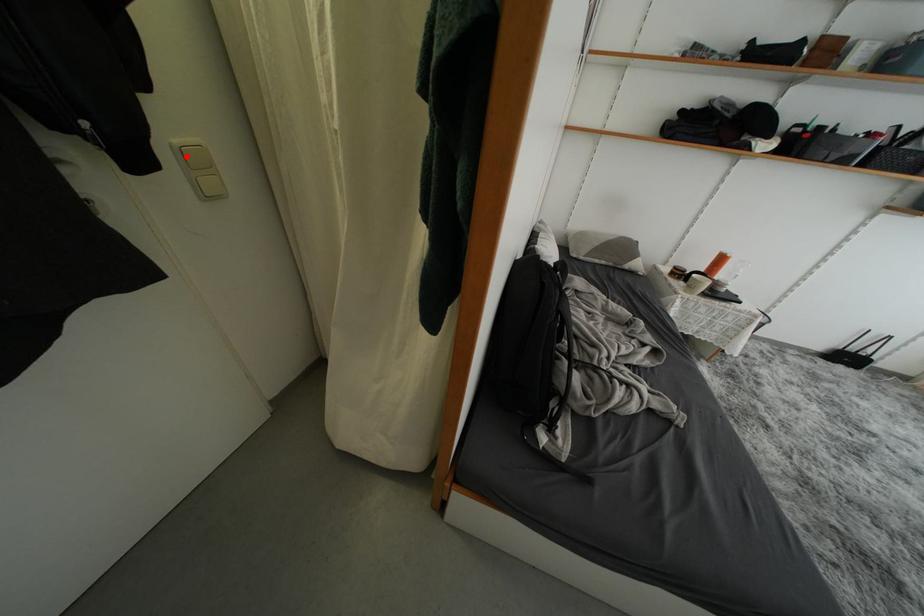
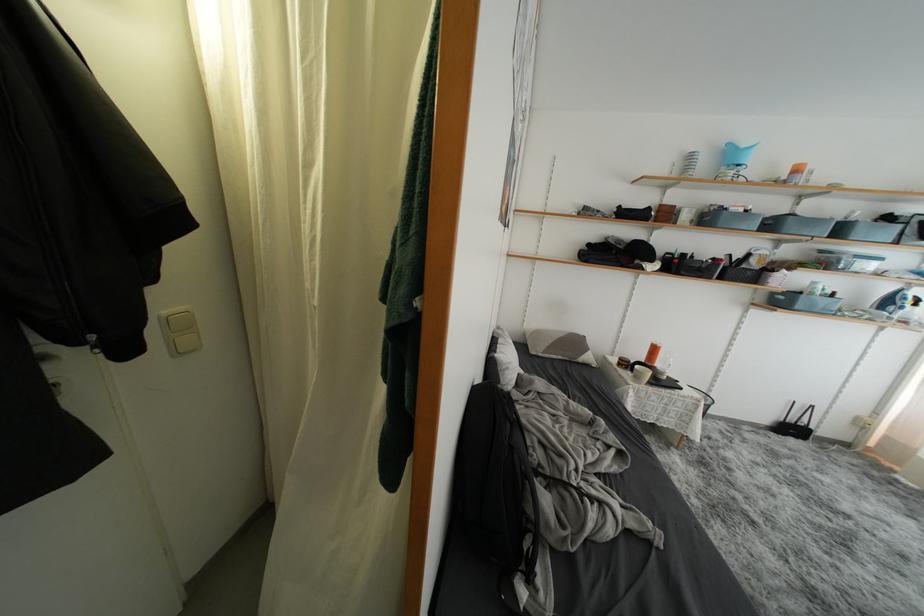
In the second image, find the point that corresponds to the highlighted location in the first image.

(172, 325)